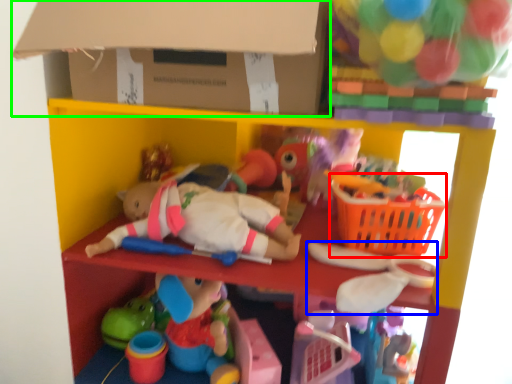
Question: Which is nearer to the basket (highlighted by a red box)? toy (highlighted by a blue box) or cardboard box (highlighted by a green box).

Choices:
 (A) toy
 (B) cardboard box

Answer: (A)